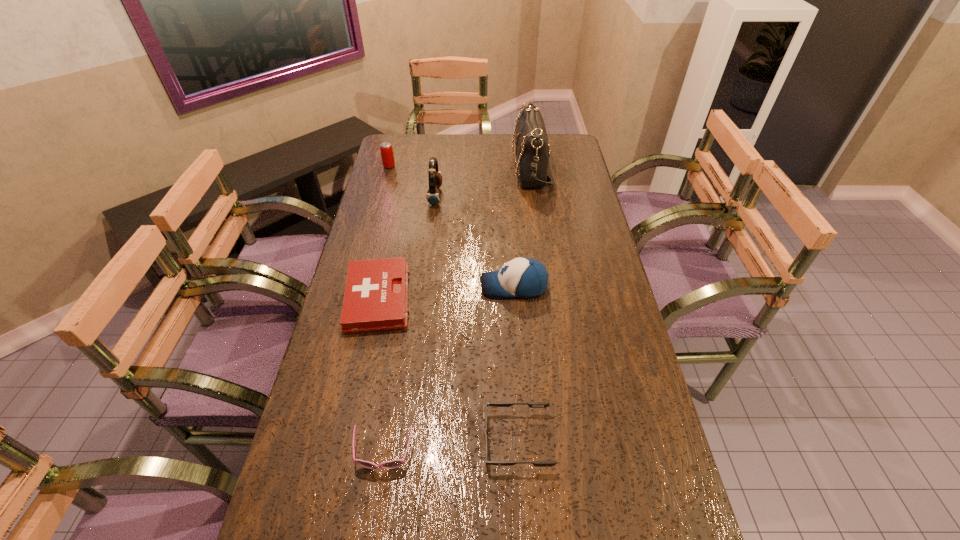
The image size is (960, 540). Find the location of `vacant area located on the ear cup of the sixth shortest object`. vacant area located on the ear cup of the sixth shortest object is located at coordinates (487, 196).

Locate an element on the screen. free region located 0.140m on the front-facing side of the baseball cap is located at coordinates (435, 286).

Locate an element on the screen. The width and height of the screenshot is (960, 540). free space located on the front-facing side of the baseball cap is located at coordinates (363, 286).

Locate an element on the screen. The height and width of the screenshot is (540, 960). vacant region located 0.370m on the front-facing side of the baseball cap is located at coordinates (359, 286).

Locate an element on the screen. free space located on the back of the beer can is located at coordinates (397, 136).

Identify the location of vacant point located on the back of the first-aid kit. This screenshot has height=540, width=960. (397, 205).

At what (x,y) coordinates should I click in order to perform the action: click on free region located on the front-facing side of the left sunglasses. Please return your answer as a coordinate pair (x, y). Image resolution: width=960 pixels, height=540 pixels. Looking at the image, I should click on (372, 524).

Locate an element on the screen. vacant space situated on the temples of the right sunglasses is located at coordinates click(366, 440).

The height and width of the screenshot is (540, 960). Identify the location of free location located 0.100m on the temples of the right sunglasses. (440, 440).

I want to click on blank space located 0.120m on the temples of the right sunglasses, so pyautogui.click(x=431, y=440).